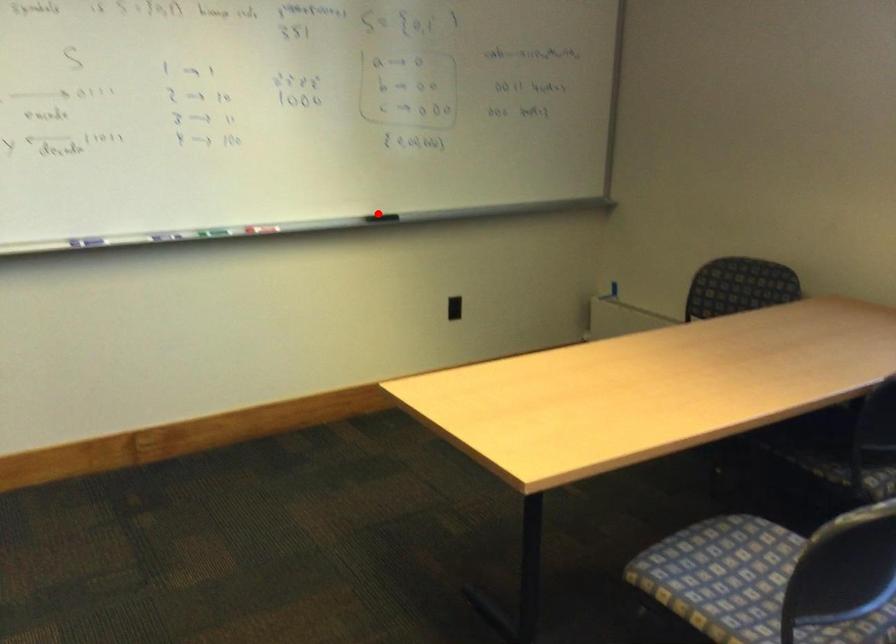
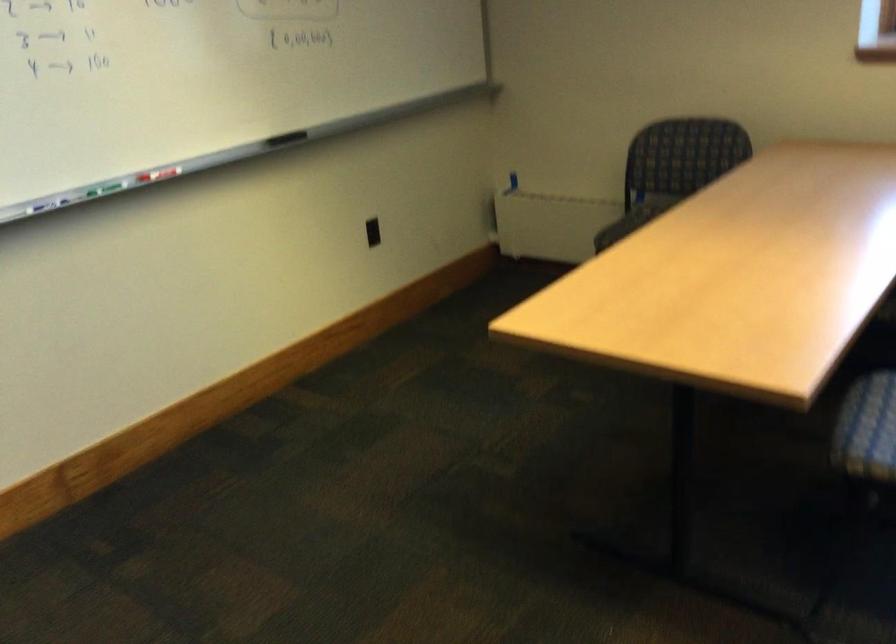
Question: A red point is marked in image1. In image2, is the corresponding 3D point closer to the camera or farther? Reply with the corresponding letter.

Choices:
 (A) The corresponding 3D point is closer.
 (B) The corresponding 3D point is farther.

Answer: (A)